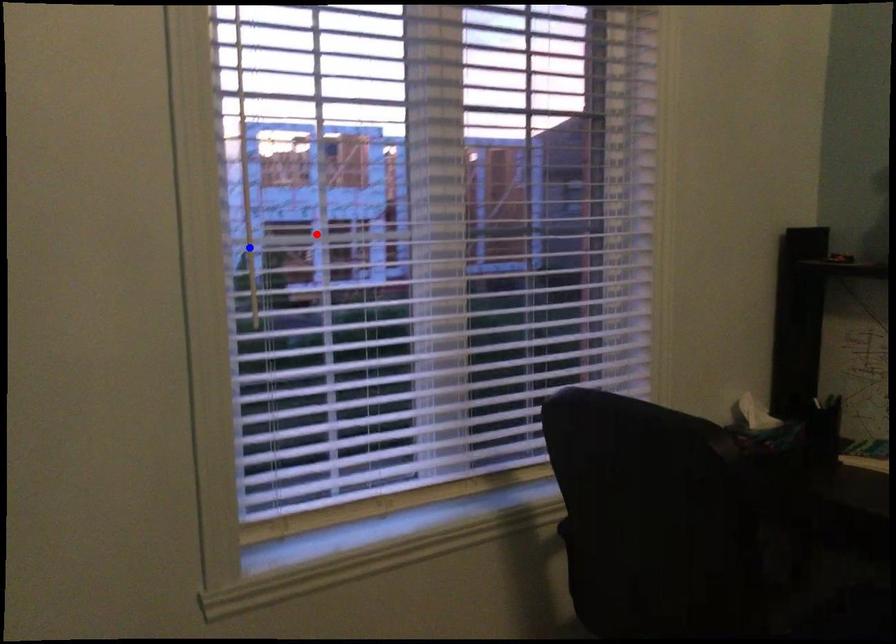
Question: Which of the two points in the image is closer to the camera?

Choices:
 (A) Blue point is closer.
 (B) Red point is closer.

Answer: (A)